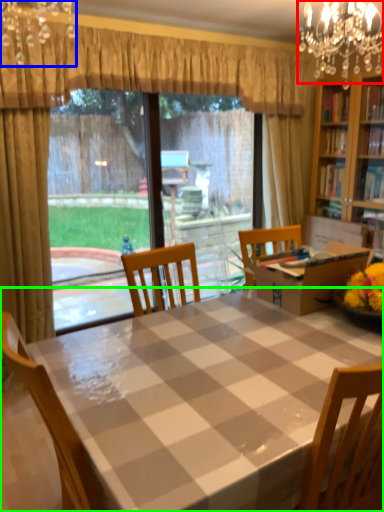
Question: Considering the real-world distances, which object is closest to light fixture (highlighted by a red box)? light fixture (highlighted by a blue box) or kitchen & dining room table (highlighted by a green box).

Choices:
 (A) light fixture
 (B) kitchen & dining room table

Answer: (A)